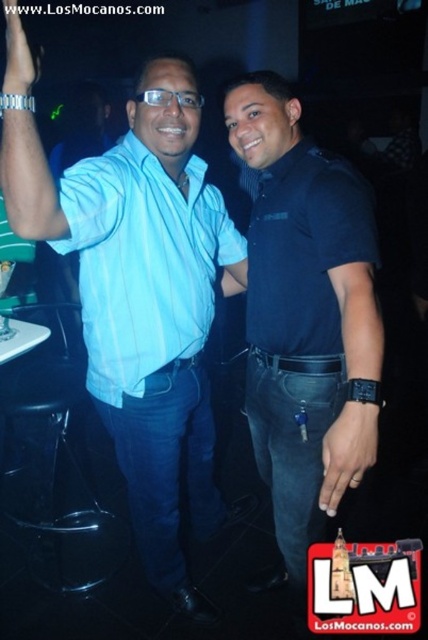
Question: Which of the following is the farthest from the observer?

Choices:
 (A) black leather watch at center
 (B) matte black wristwatch at upper left
 (C) dark blue shirt at center
 (D) light blue striped shirt at center

Answer: (D)

Question: Is the position of dark blue shirt at center less distant than that of light blue striped shirt at center?

Choices:
 (A) no
 (B) yes

Answer: (B)

Question: Is light blue shirt at center thinner than black leather watch at center?

Choices:
 (A) no
 (B) yes

Answer: (A)

Question: Is light blue shirt at center to the left of dark blue shirt at center from the viewer's perspective?

Choices:
 (A) no
 (B) yes

Answer: (B)

Question: Based on their relative distances, which object is farther from the light blue shirt at center?

Choices:
 (A) light blue striped shirt at center
 (B) black leather watch at center
 (C) matte black wristwatch at upper left
 (D) dark blue shirt at center

Answer: (C)

Question: Which point appears farthest from the camera in this image?

Choices:
 (A) (261, 108)
 (B) (24, 42)
 (C) (80, 208)

Answer: (A)